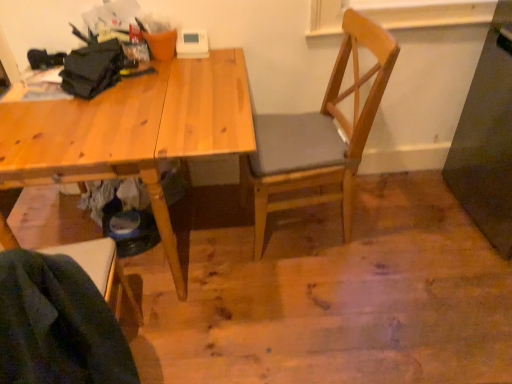
Image resolution: width=512 pixels, height=384 pixels. Find the location of `vacant space in front of wooden chair at center, arranged as the 1th chair when viewed from the back`. vacant space in front of wooden chair at center, arranged as the 1th chair when viewed from the back is located at coordinates (318, 293).